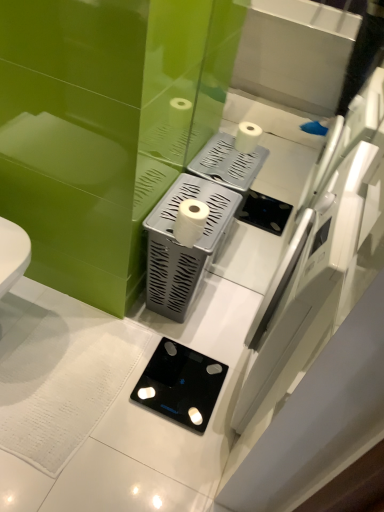
Locate an element on the screen. vacant region below black glass scale at lower center (from a real-world perspective) is located at coordinates coord(188,366).